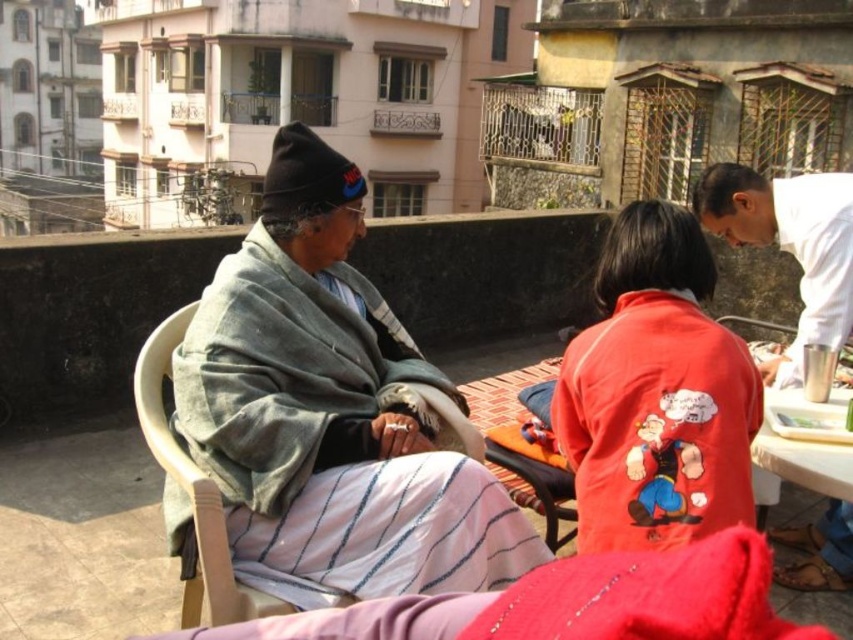
Consider the image. You are a photographer on the rooftop and want to take a photo of the wooden chair at center without the red matte jacket at center appearing in the frame. How can you adjust your position to achieve this?

The red matte jacket at center is positioned over the wooden chair at center. To avoid capturing the jacket in the frame, move to a position where the jacket is no longer obscuring the chair, such as shifting to the side or adjusting the angle of your camera so that the jacket is out of view.

You are a delivery person standing at the entrance of the rooftop. You need to deliver a package to the gray woolen shawl at left and then to the red matte jacket at center. If your delivery cart can only move 5 meters before needing to recharge, can you deliver both items without recharging?

The gray woolen shawl at left is 4.84 meters away from the red matte jacket at center. Since the distance between them is less than 5 meters, you can deliver both items without needing to recharge your cart.

You are standing on the rooftop and want to sit down next to the child wearing the red matte jacket at center. Is the wooden chair at center available for you to sit on?

The wooden chair at center is behind the red matte jacket at center, so it is likely available for you to sit on since it is positioned behind the child.